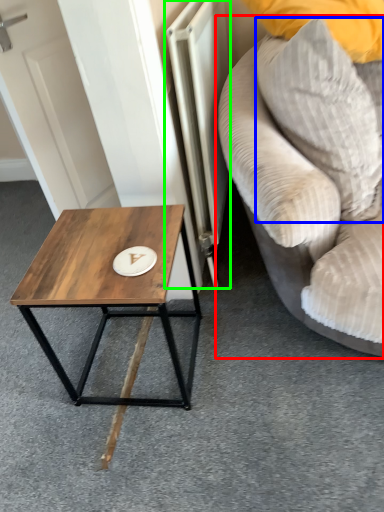
Question: Considering the real-world distances, which object is closest to studio couch (highlighted by a red box)? pillow (highlighted by a blue box) or radiator (highlighted by a green box).

Choices:
 (A) pillow
 (B) radiator

Answer: (A)